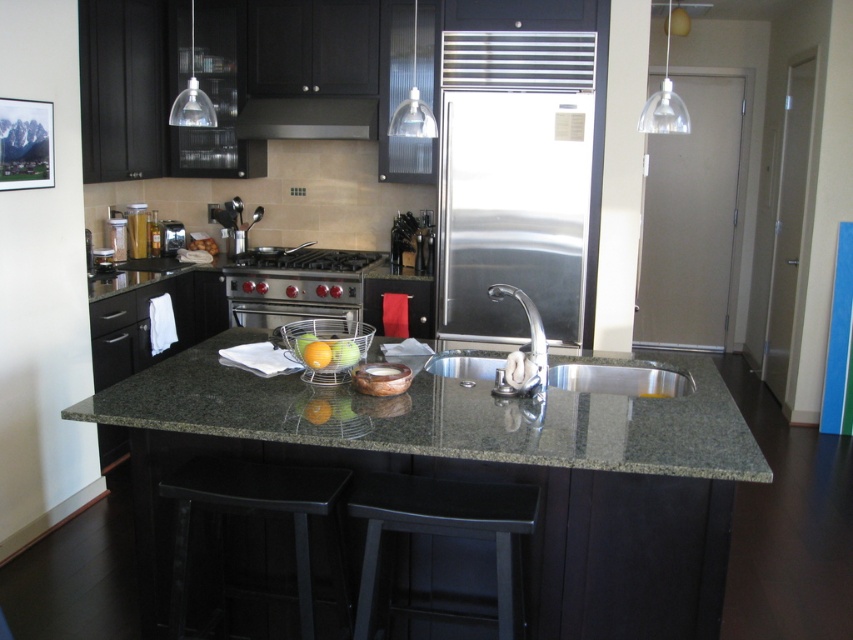
Question: Among these objects, which one is nearest to the camera?

Choices:
 (A) stainless steel stove at center
 (B) black matte bar stool at lower left
 (C) stainless steel refrigerator at center
 (D) black matte exhaust hood at upper center

Answer: (B)

Question: Does black matte bar stool at lower left come in front of stainless steel stove at center?

Choices:
 (A) yes
 (B) no

Answer: (A)

Question: Does black matte bar stool at lower left have a larger size compared to stainless steel stove at center?

Choices:
 (A) yes
 (B) no

Answer: (B)

Question: Is stainless steel refrigerator at center below stainless steel sink at center?

Choices:
 (A) yes
 (B) no

Answer: (B)

Question: Which point is closer to the camera?

Choices:
 (A) stainless steel refrigerator at center
 (B) stainless steel oven at center
 (C) stainless steel sink at center
 (D) satin nickel stove at center

Answer: (C)

Question: Considering the real-world distances, which object is farthest from the stainless steel sink at center?

Choices:
 (A) stainless steel stove at center
 (B) stainless steel oven at center
 (C) black matte bar stool at lower center
 (D) black matte bar stool at lower left

Answer: (A)